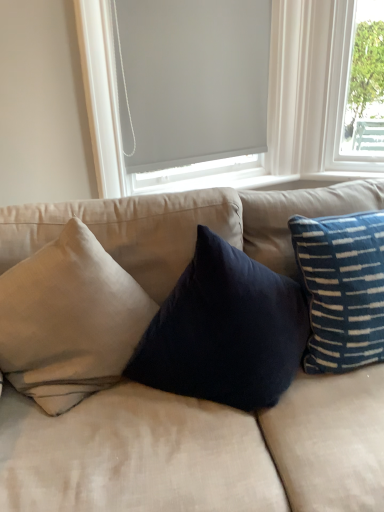
Question: Is there a large distance between blue striped pillow at right, which is the first pillow in right-to-left order, and matte gray roller shade at upper center?

Choices:
 (A) no
 (B) yes

Answer: (B)

Question: Does blue striped pillow at right, which is the first pillow in right-to-left order, turn towards matte gray roller shade at upper center?

Choices:
 (A) yes
 (B) no

Answer: (B)

Question: From a real-world perspective, is blue striped pillow at right, which is the first pillow in right-to-left order, physically above matte gray roller shade at upper center?

Choices:
 (A) no
 (B) yes

Answer: (A)

Question: Can you confirm if blue striped pillow at right, which is the first pillow in right-to-left order, is positioned to the left of matte gray roller shade at upper center?

Choices:
 (A) no
 (B) yes

Answer: (A)

Question: Considering the relative sizes of blue striped pillow at right, which is the second pillow from left to right, and matte gray roller shade at upper center in the image provided, is blue striped pillow at right, which is the second pillow from left to right, smaller than matte gray roller shade at upper center?

Choices:
 (A) yes
 (B) no

Answer: (A)

Question: Considering their positions, is gray matte window screen at upper center located in front of or behind matte gray roller shade at upper center?

Choices:
 (A) front
 (B) behind

Answer: (B)

Question: In terms of size, does gray matte window screen at upper center appear bigger or smaller than matte gray roller shade at upper center?

Choices:
 (A) small
 (B) big

Answer: (A)

Question: Would you say gray matte window screen at upper center is inside or outside matte gray roller shade at upper center?

Choices:
 (A) inside
 (B) outside

Answer: (A)

Question: Does point (117, 81) appear closer or farther from the camera than point (117, 109)?

Choices:
 (A) farther
 (B) closer

Answer: (B)

Question: From a real-world perspective, is blue striped pillow at right, which is the second pillow from left to right, physically located above or below beige fabric couch at center?

Choices:
 (A) above
 (B) below

Answer: (A)

Question: Is blue striped pillow at right, which is the first pillow in right-to-left order, wider or thinner than beige fabric couch at center?

Choices:
 (A) wide
 (B) thin

Answer: (B)

Question: In the image, is blue striped pillow at right, which is the second pillow from left to right, on the left side or the right side of beige fabric couch at center?

Choices:
 (A) left
 (B) right

Answer: (B)

Question: Is blue striped pillow at right, which is the second pillow from left to right, bigger or smaller than beige fabric couch at center?

Choices:
 (A) small
 (B) big

Answer: (A)

Question: Is beige fabric couch at center wider or thinner than matte gray roller shade at upper center?

Choices:
 (A) thin
 (B) wide

Answer: (B)

Question: From the image's perspective, is beige fabric couch at center located above or below matte gray roller shade at upper center?

Choices:
 (A) above
 (B) below

Answer: (B)